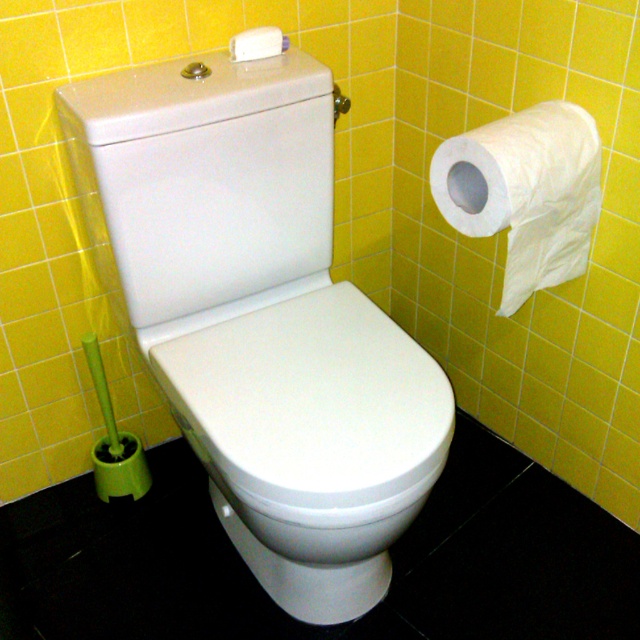
Question: Which object appears closest to the camera in this image?

Choices:
 (A) white matte tissue at upper center
 (B) white paper at upper right

Answer: (B)

Question: Does white paper at upper right lie behind white matte tissue at upper center?

Choices:
 (A) no
 (B) yes

Answer: (A)

Question: Which point appears farthest from the camera in this image?

Choices:
 (A) (433, 156)
 (B) (256, 35)

Answer: (A)

Question: Which point is farther to the camera?

Choices:
 (A) white paper at upper right
 (B) white matte tissue at upper center

Answer: (B)

Question: Can you confirm if white paper at upper right is wider than white matte tissue at upper center?

Choices:
 (A) no
 (B) yes

Answer: (B)

Question: Does white paper at upper right have a smaller size compared to white matte tissue at upper center?

Choices:
 (A) yes
 (B) no

Answer: (B)